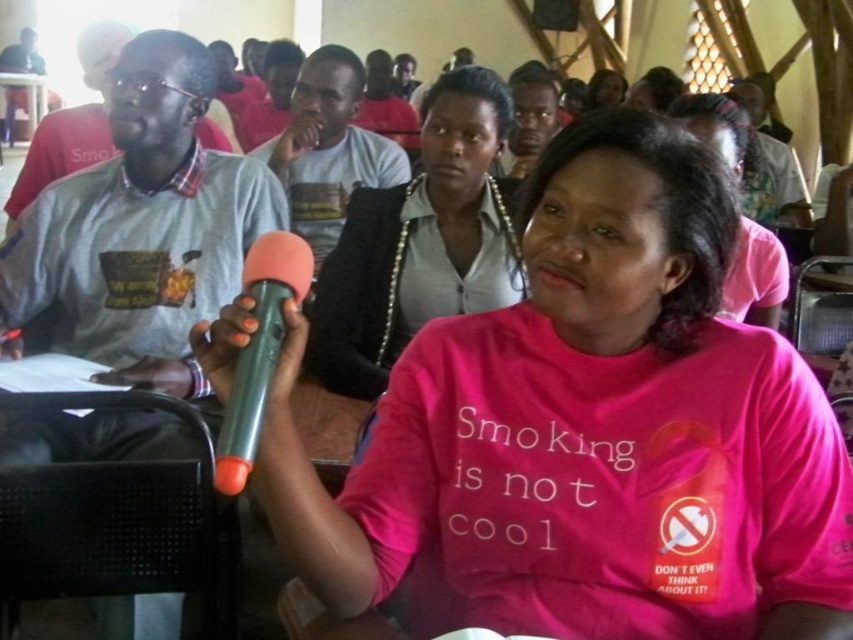
Question: Is orange matte microphone at center to the right of matte black hair at upper center from the viewer's perspective?

Choices:
 (A) yes
 (B) no

Answer: (B)

Question: Which object is positioned closest to the matte black hair at upper center?

Choices:
 (A) orange matte microphone at center
 (B) white glossy shirt at center
 (C) matte white shirt at center

Answer: (C)

Question: Which of the following is the closest to the observer?

Choices:
 (A) matte gray shirt at center
 (B) matte gray shirt at upper left
 (C) pink matte shirt at center

Answer: (C)

Question: Which point is farther to the camera?

Choices:
 (A) (287, 296)
 (B) (166, 259)

Answer: (B)

Question: Is matte gray shirt at center to the right of white glossy shirt at center from the viewer's perspective?

Choices:
 (A) no
 (B) yes

Answer: (A)

Question: Is orange matte microphone at center wider than matte gray shirt at upper left?

Choices:
 (A) yes
 (B) no

Answer: (B)